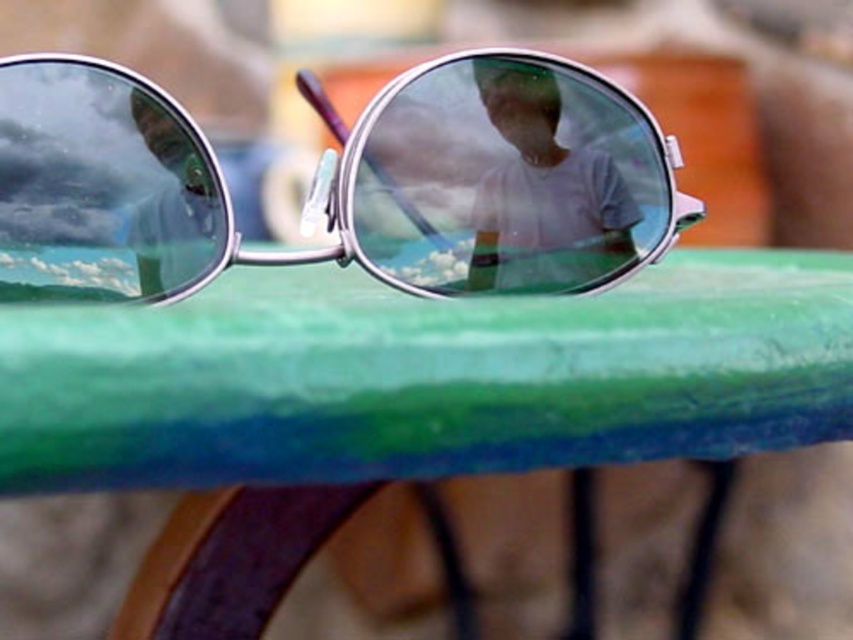
Question: Which point is closer to the camera?

Choices:
 (A) matte white shirt at center
 (B) metallic round goggles at center

Answer: (B)

Question: Does metallic round goggles at center appear on the left side of matte white shirt at center?

Choices:
 (A) no
 (B) yes

Answer: (B)

Question: Does metallic round goggles at center lie in front of matte white shirt at center?

Choices:
 (A) no
 (B) yes

Answer: (B)

Question: Which point is farther to the camera?

Choices:
 (A) matte white shirt at center
 (B) metallic round goggles at center

Answer: (A)

Question: Is metallic round goggles at center above matte white shirt at center?

Choices:
 (A) yes
 (B) no

Answer: (B)